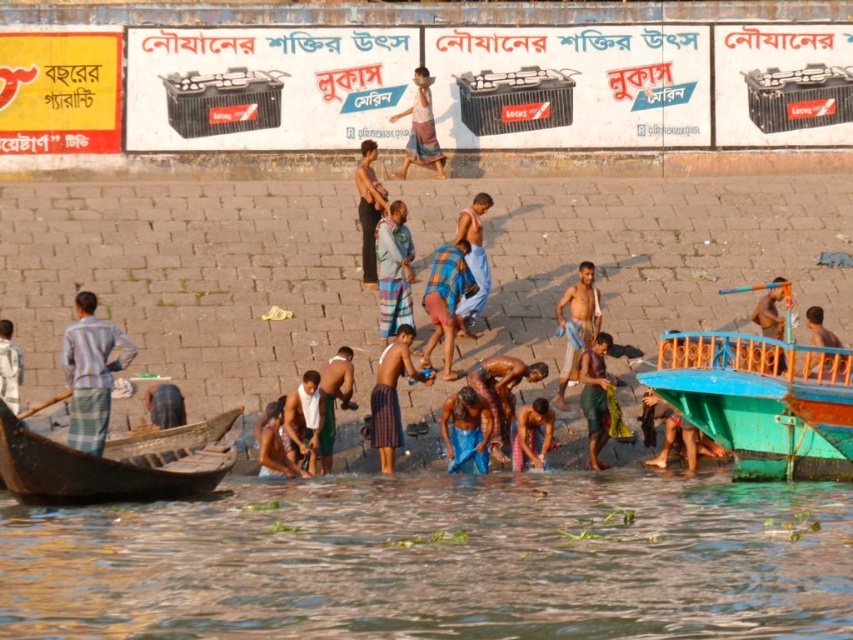
Question: Which of the following is the closest to the observer?

Choices:
 (A) (393, 340)
 (B) (376, 209)
 (C) (775, 461)
 (D) (28, 481)

Answer: (D)

Question: Estimate the real-world distances between objects in this image. Which object is closer to the blue fabric at center?

Choices:
 (A) brown textured cloth at lower center
 (B) orange plastic paddle at center

Answer: (A)

Question: Among these objects, which one is nearest to the camera?

Choices:
 (A) brown wooden boat at right
 (B) teal wooden boat at right
 (C) white towel at lower center

Answer: (A)

Question: Is teal wooden boat at right closer to camera compared to light blue fabric shirt at lower left?

Choices:
 (A) yes
 (B) no

Answer: (A)

Question: Is brown textured fabric at center wider than light brown fabric shirt at center?

Choices:
 (A) no
 (B) yes

Answer: (B)

Question: Observing the image, what is the correct spatial positioning of brown wooden boat at lower left in reference to blue fabric at center?

Choices:
 (A) left
 (B) right

Answer: (A)